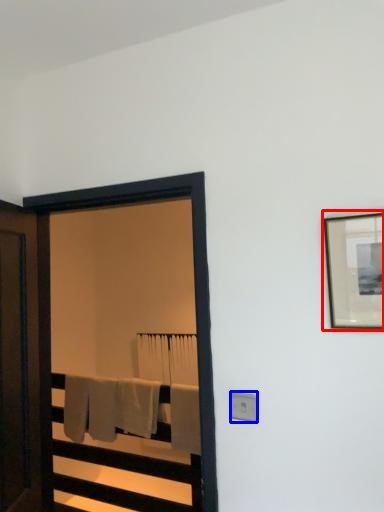
Question: Which of the following is the closest to the observer, picture frame (highlighted by a red box) or electric outlet (highlighted by a blue box)?

Choices:
 (A) picture frame
 (B) electric outlet

Answer: (A)